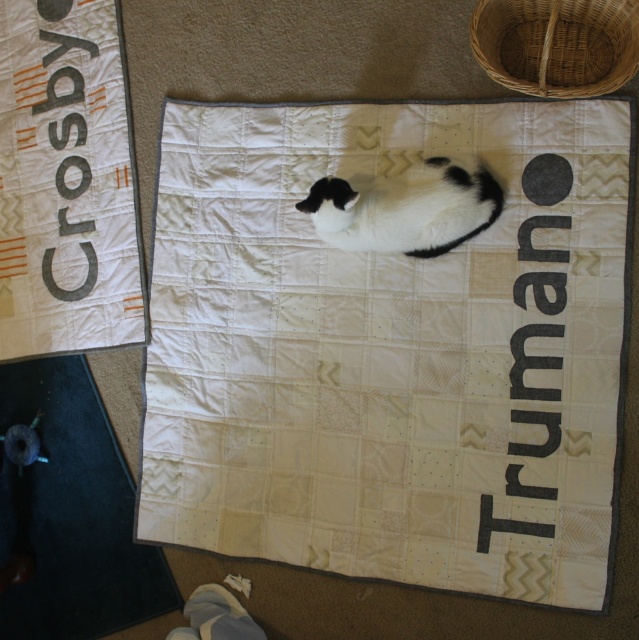
You are a photographer trying to capture both the white quilt at center and the black and white fur cat at center in a single shot. Since you want both subjects to be in focus, which one should you adjust your camera focus on first?

You should focus on the white quilt at center first because it is closer to the viewer than the black and white fur cat at center, ensuring both will be in focus when using depth of field appropriately.

You are a guest in this room and want to sit on the closest object between the white quilt at upper left and the dark gray rubber mat at lower left. Which one should you choose?

The white quilt at upper left is closer to the viewer, so you should choose the white quilt at upper left to sit on.

You are standing at the entrance of the room and want to place a new decorative item on the dark gray rubber mat at lower left. Based on the coordinates provided, can you determine if the mat is positioned near the left edge of the room?

The dark gray rubber mat at lower left is located at point (72, 513), which indicates it is positioned near the left edge of the room since the x and y coordinates are both less than 1, suggesting proximity to the edges.